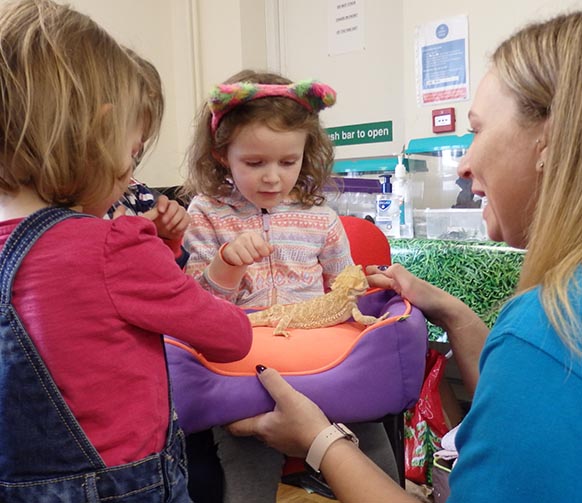
Where is `wall`? wall is located at coordinates (x=166, y=34), (x=365, y=66).